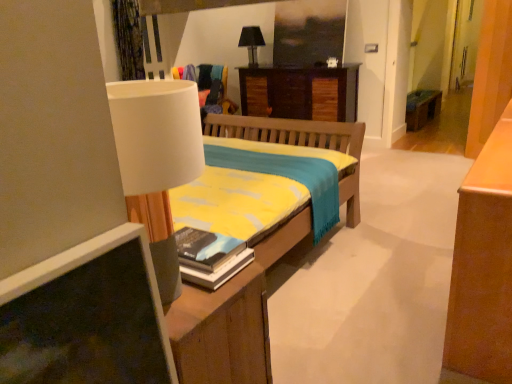
Question: From a real-world perspective, does wooden desk at center stand above hardcover book at center?

Choices:
 (A) no
 (B) yes

Answer: (A)

Question: Is wooden desk at center taller than hardcover book at center?

Choices:
 (A) yes
 (B) no

Answer: (A)

Question: Is wooden desk at center turned away from hardcover book at center?

Choices:
 (A) no
 (B) yes

Answer: (A)

Question: Is wooden desk at center outside of hardcover book at center?

Choices:
 (A) no
 (B) yes

Answer: (B)

Question: From the image's perspective, is wooden desk at center located above hardcover book at center?

Choices:
 (A) no
 (B) yes

Answer: (B)

Question: From a real-world perspective, is hardcover book at center above or below wooden desk at center?

Choices:
 (A) above
 (B) below

Answer: (A)

Question: Is hardcover book at center bigger or smaller than wooden desk at center?

Choices:
 (A) small
 (B) big

Answer: (A)

Question: Does point (217, 253) appear closer or farther from the camera than point (349, 120)?

Choices:
 (A) farther
 (B) closer

Answer: (B)

Question: Is hardcover book at center situated inside wooden desk at center or outside?

Choices:
 (A) inside
 (B) outside

Answer: (B)

Question: From the image's perspective, relative to wooden bench at right, is hardcover book at center above or below?

Choices:
 (A) above
 (B) below

Answer: (B)

Question: Considering their positions, is hardcover book at center located in front of or behind wooden bench at right?

Choices:
 (A) behind
 (B) front

Answer: (B)

Question: Is hardcover book at center inside the boundaries of wooden bench at right, or outside?

Choices:
 (A) outside
 (B) inside

Answer: (A)

Question: Is point (238, 258) positioned closer to the camera than point (410, 102)?

Choices:
 (A) farther
 (B) closer

Answer: (B)

Question: In the image, is wooden bench at right positioned in front of or behind black fabric lampshade at upper center?

Choices:
 (A) front
 (B) behind

Answer: (B)

Question: Considering the relative positions of wooden bench at right and black fabric lampshade at upper center in the image provided, is wooden bench at right to the left or to the right of black fabric lampshade at upper center?

Choices:
 (A) left
 (B) right

Answer: (B)